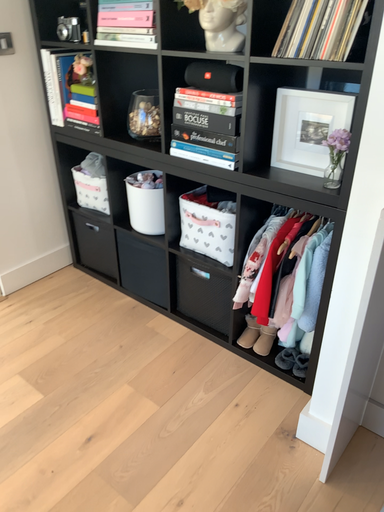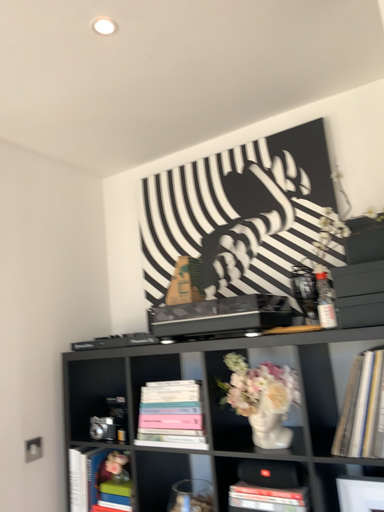
Question: Which way did the camera rotate in the video?

Choices:
 (A) rotated upward
 (B) rotated downward

Answer: (A)